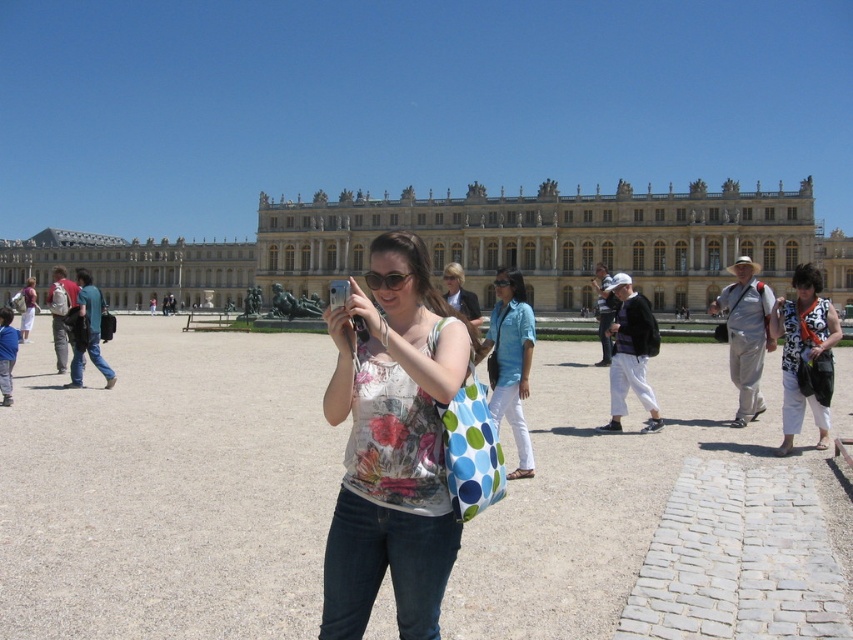
Question: Does blue cotton shirt at center have a smaller size compared to blue jeans at left?

Choices:
 (A) yes
 (B) no

Answer: (A)

Question: Which of these objects is positioned closest to the white cotton pants at center?

Choices:
 (A) white cotton shirt at right
 (B) floral printed tank top at center

Answer: (A)

Question: Which object is closer to the camera taking this photo?

Choices:
 (A) beige stone palace at center
 (B) white cotton shirt at right

Answer: (B)

Question: Which of the following is the farthest from the observer?

Choices:
 (A) matte gray backpack at left
 (B) blue cotton shirt at center
 (C) blue jeans at left

Answer: (A)

Question: Does white cotton shirt at right come behind white cotton shirt at center?

Choices:
 (A) yes
 (B) no

Answer: (B)

Question: Does light gray fabric hat at right have a smaller size compared to blue jeans at left?

Choices:
 (A) yes
 (B) no

Answer: (A)